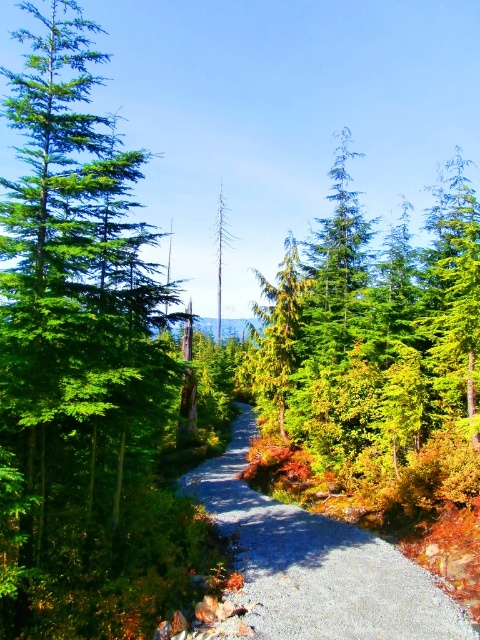
Does green matte tree at center have a lesser width compared to gray gravel path at center?

In fact, green matte tree at center might be wider than gray gravel path at center.

Is green matte tree at center wider than gray gravel path at center?

Correct, the width of green matte tree at center exceeds that of gray gravel path at center.

This screenshot has width=480, height=640. What do you see at coordinates (376, 355) in the screenshot?
I see `green matte tree at center` at bounding box center [376, 355].

Locate an element on the screen. green matte tree at center is located at coordinates (376, 355).